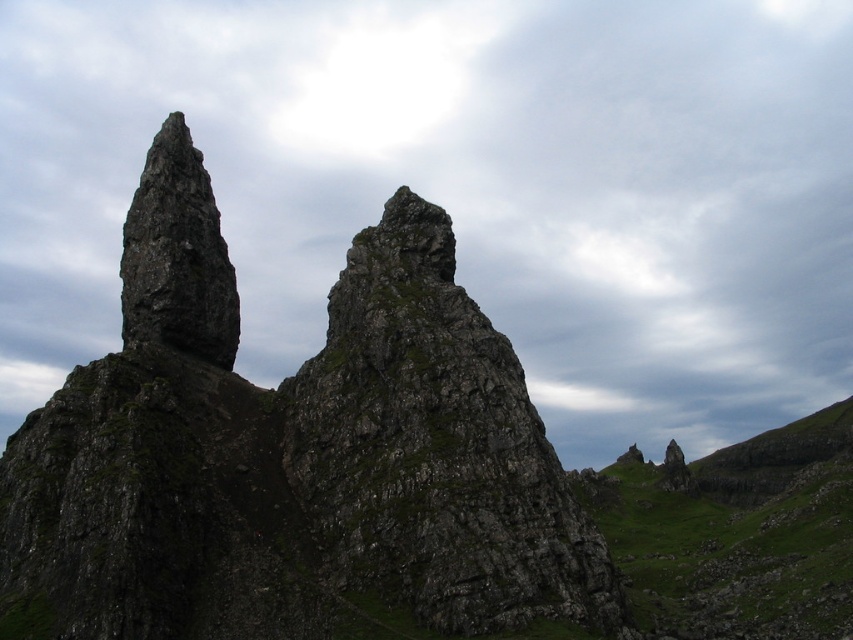
Question: Which is farther from the rough stone rock at center?

Choices:
 (A) rough stone peak at left
 (B) gray cloudy sky at upper center
 (C) rough stone rock formation at center
 (D) green grassy hillside at upper center

Answer: (B)

Question: Is gray cloudy sky at upper center wider than rough stone rock formation at center?

Choices:
 (A) no
 (B) yes

Answer: (B)

Question: Is rough stone rock formation at center closer to the viewer compared to rough stone rock at center?

Choices:
 (A) yes
 (B) no

Answer: (A)

Question: Based on their relative distances, which object is farther from the rough stone rock at center?

Choices:
 (A) rough stone rock formation at center
 (B) gray cloudy sky at upper center
 (C) green grassy hillside at upper center
 (D) rough stone peak at left

Answer: (B)

Question: Can you confirm if rough stone rock at center is smaller than rough stone peak at left?

Choices:
 (A) yes
 (B) no

Answer: (B)

Question: Which point is closer to the camera?

Choices:
 (A) (160, 212)
 (B) (846, 339)
 (C) (543, 611)
 (D) (596, 550)

Answer: (C)